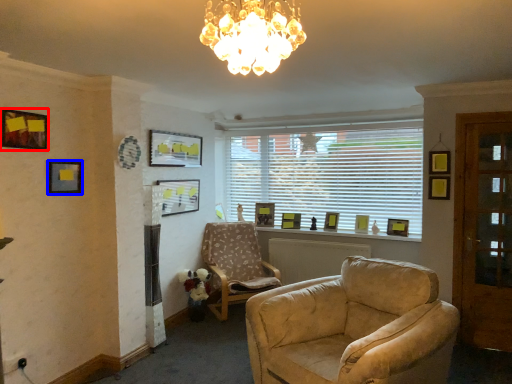
Question: Which point is further to the camera, picture frame (highlighted by a red box) or picture frame (highlighted by a blue box)?

Choices:
 (A) picture frame
 (B) picture frame

Answer: (B)